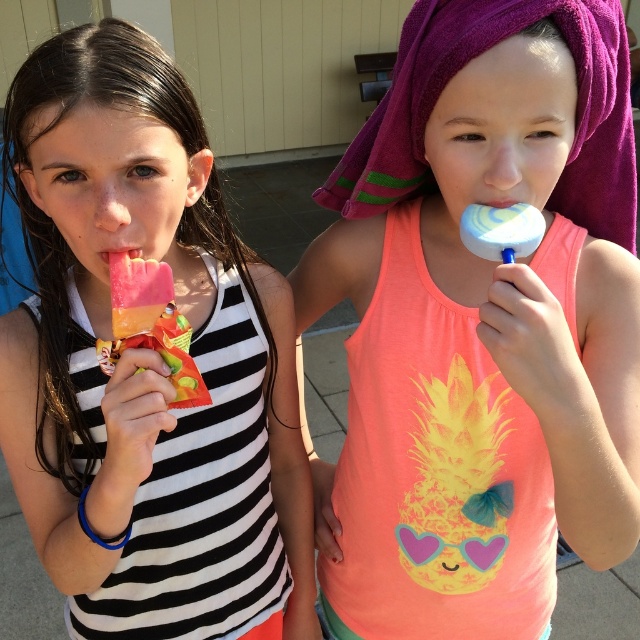
You are a parent at a beach party and want to give your kids a treat. You have a matte plastic popsicle at left and a pink matte lollipop at center. Which treat can you give to a child with a smaller mouth to ensure it fits comfortably?

The pink matte lollipop at center is smaller in size compared to the matte plastic popsicle at left, so it would be more suitable for a child with a smaller mouth.

From the picture: You are standing in front of the two girls and want to place a new popsicle holder between the two points marked as point (x=124, y=291) and point (x=122, y=257). Which point should the holder be closer to in order to be closer to the girl who is holding a blue and white popsicle?

The popsicle holder should be placed closer to point (x=122, y=257) because the girl holding the blue and white popsicle is located there, and point (x=122, y=257) is farther from the viewer compared to point (x=124, y=291), meaning it is closer to her position.

You are a parent who wants to ensure your children can safely reach both the matte blue lollipop at center and the pink matte popsicle at left while sitting on a bench that is 12 inches wide. Can they both reach the treats without moving their seats?

The distance between the matte blue lollipop at center and the pink matte popsicle at left is 11.00 inches, which is less than the 12 inch width of the bench. Therefore, the children can reach both treats while sitting on the bench without needing to move their seats.